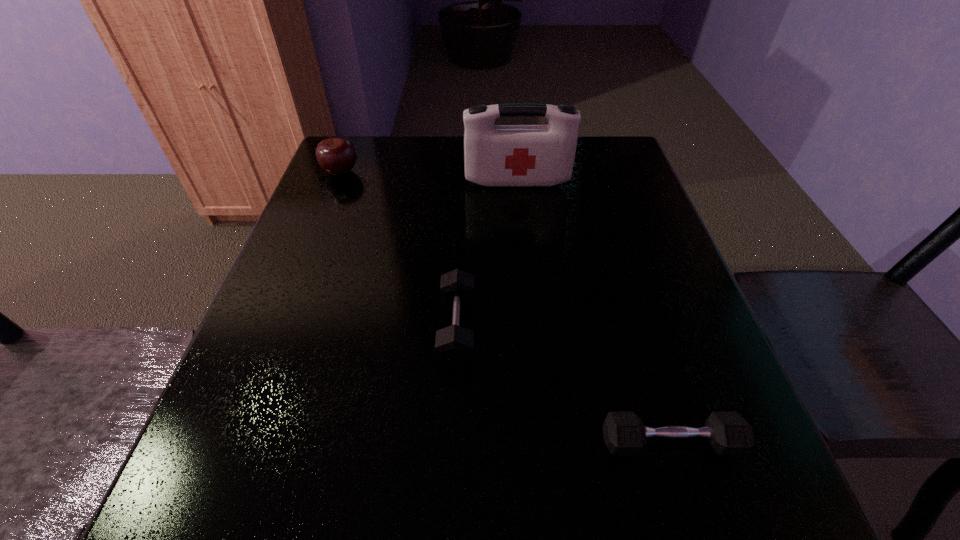
Where is `vacant space at the far right corner of the desktop`? This screenshot has height=540, width=960. vacant space at the far right corner of the desktop is located at coordinates (610, 140).

I want to click on empty location between the first-aid kit and the third shortest object, so click(429, 177).

Image resolution: width=960 pixels, height=540 pixels. What are the coordinates of `vacant area between the leftmost object and the first-aid kit` in the screenshot? It's located at (429, 177).

Identify the location of vacant region between the leftmost object and the taller dumbbell. (399, 250).

At what (x,y) coordinates should I click in order to perform the action: click on unoccupied area between the tallest object and the second shortest object. Please return your answer as a coordinate pair (x, y). The height and width of the screenshot is (540, 960). Looking at the image, I should click on [488, 254].

The height and width of the screenshot is (540, 960). What are the coordinates of `vacant space that's between the third farthest object and the first-aid kit` in the screenshot? It's located at (488, 254).

Identify the location of free space that is in between the farther dumbbell and the shortest object. (564, 385).

The width and height of the screenshot is (960, 540). I want to click on free space that is in between the tallest object and the leftmost object, so click(429, 177).

Identify the location of free area in between the tallest object and the farther dumbbell. This screenshot has height=540, width=960. (488, 254).

Locate an element on the screen. This screenshot has width=960, height=540. free spot between the shorter dumbbell and the apple is located at coordinates (505, 307).